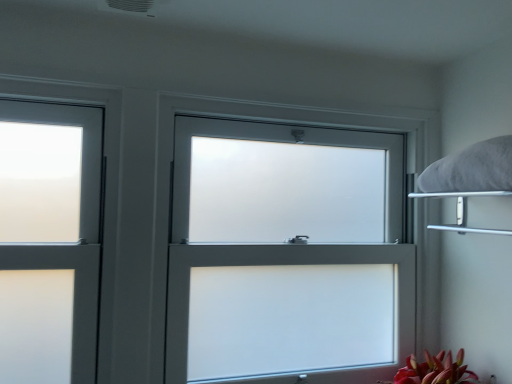
Question: From a real-world perspective, is white fluffy pillow at upper right physically below metallic silver shelf at upper right?

Choices:
 (A) yes
 (B) no

Answer: (B)

Question: Is white fluffy pillow at upper right at the left side of metallic silver shelf at upper right?

Choices:
 (A) yes
 (B) no

Answer: (B)

Question: Is white fluffy pillow at upper right bigger than metallic silver shelf at upper right?

Choices:
 (A) no
 (B) yes

Answer: (A)

Question: Can you confirm if white fluffy pillow at upper right is shorter than metallic silver shelf at upper right?

Choices:
 (A) yes
 (B) no

Answer: (B)

Question: Is white fluffy pillow at upper right smaller than metallic silver shelf at upper right?

Choices:
 (A) no
 (B) yes

Answer: (B)

Question: Is point (461, 200) closer or farther from the camera than point (458, 170)?

Choices:
 (A) farther
 (B) closer

Answer: (A)

Question: From the image's perspective, is metallic silver shelf at upper right located above or below white fluffy pillow at upper right?

Choices:
 (A) above
 (B) below

Answer: (B)

Question: Considering the positions of metallic silver shelf at upper right and white fluffy pillow at upper right in the image, is metallic silver shelf at upper right bigger or smaller than white fluffy pillow at upper right?

Choices:
 (A) big
 (B) small

Answer: (A)

Question: Visually, is metallic silver shelf at upper right positioned to the left or to the right of white fluffy pillow at upper right?

Choices:
 (A) left
 (B) right

Answer: (A)

Question: From the image's perspective, is white frosted glass window at center above or below metallic silver shelf at upper right?

Choices:
 (A) below
 (B) above

Answer: (A)

Question: Looking at the image, does white frosted glass window at center seem bigger or smaller compared to metallic silver shelf at upper right?

Choices:
 (A) big
 (B) small

Answer: (A)

Question: Relative to metallic silver shelf at upper right, is white frosted glass window at center in front or behind?

Choices:
 (A) behind
 (B) front

Answer: (A)

Question: From a real-world perspective, is white frosted glass window at center physically located above or below metallic silver shelf at upper right?

Choices:
 (A) above
 (B) below

Answer: (B)

Question: From their relative heights in the image, would you say white fluffy pillow at upper right is taller or shorter than metallic silver shelf at upper right?

Choices:
 (A) short
 (B) tall

Answer: (B)

Question: Is white fluffy pillow at upper right spatially inside metallic silver shelf at upper right, or outside of it?

Choices:
 (A) outside
 (B) inside

Answer: (A)